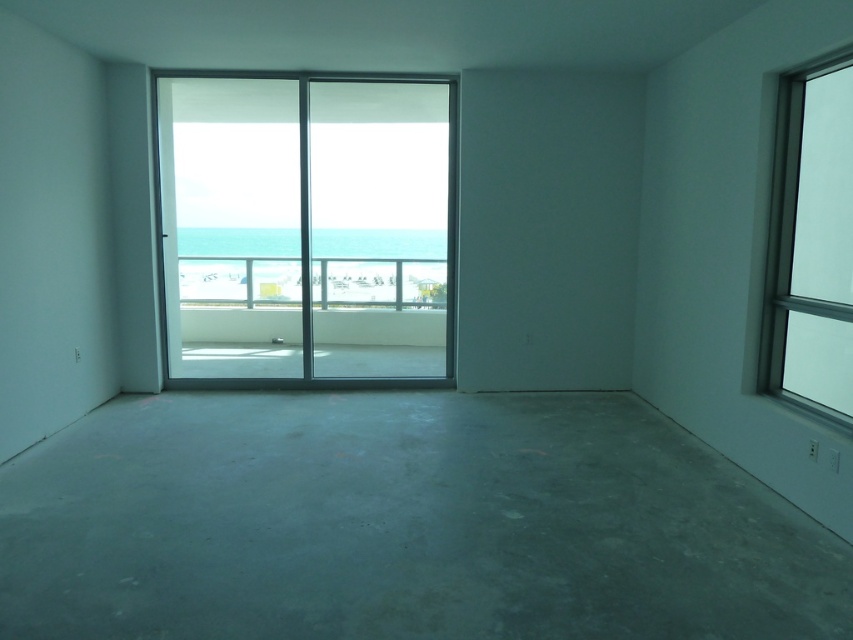
Question: Which point appears closest to the camera in this image?

Choices:
 (A) (816, 403)
 (B) (283, 321)

Answer: (A)

Question: In this image, where is transparent glass screen door at center located relative to clear glass window at right?

Choices:
 (A) left
 (B) right

Answer: (A)

Question: Is the position of transparent glass screen door at center less distant than that of clear glass window at right?

Choices:
 (A) yes
 (B) no

Answer: (B)

Question: Does transparent glass screen door at center appear under clear glass window at right?

Choices:
 (A) no
 (B) yes

Answer: (A)